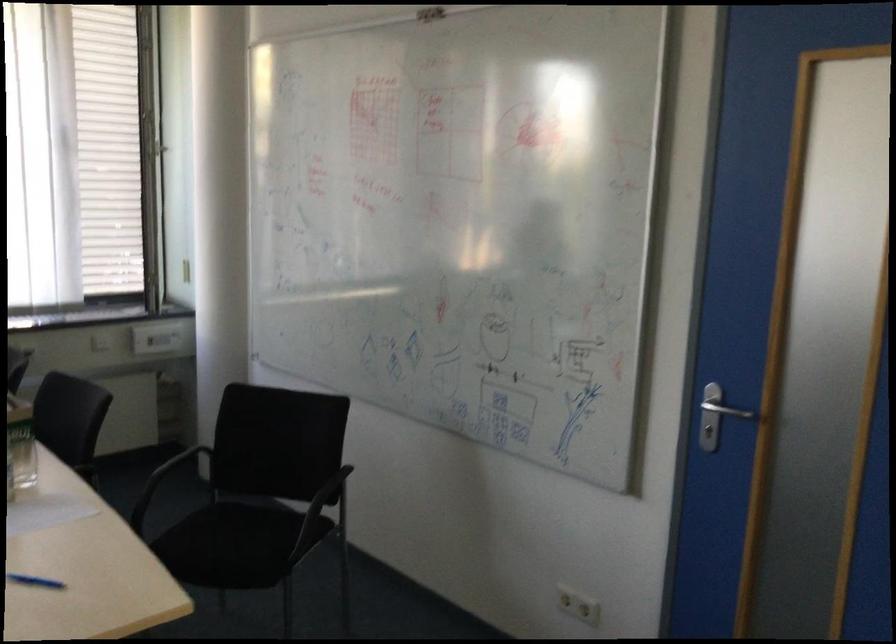
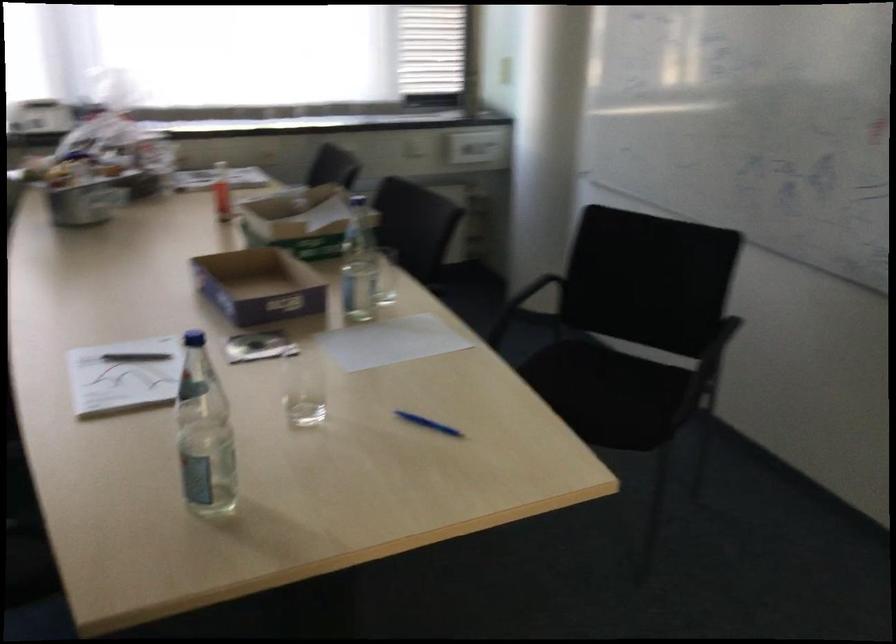
Question: The camera is either moving clockwise (left) or counter-clockwise (right) around the object. The first image is from the beginning of the video and the second image is from the end. Is the camera moving left or right when shooting the video?

Choices:
 (A) Left
 (B) Right

Answer: (B)